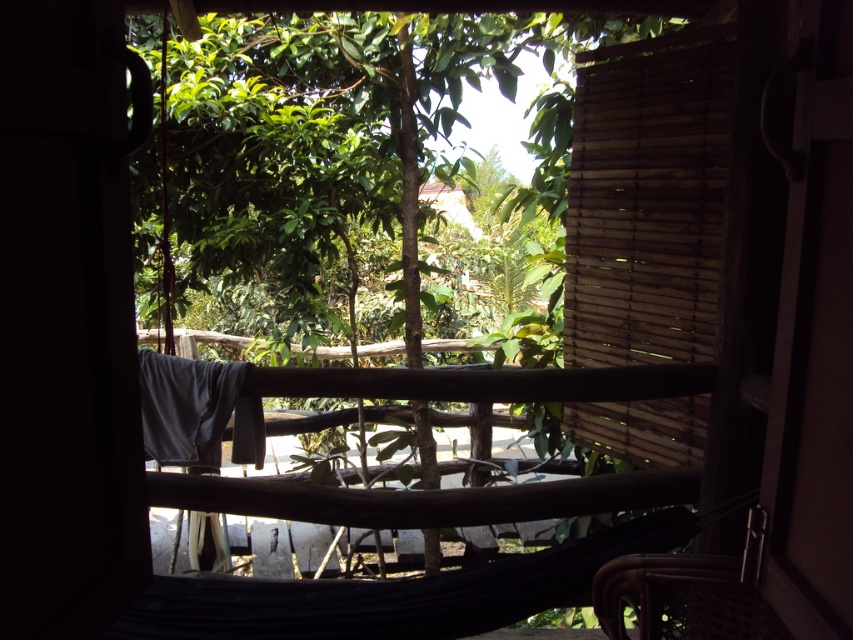
Question: Considering the real-world distances, which object is closest to the green leafy tree at center?

Choices:
 (A) brown woven chair at lower right
 (B) wooden blinds at right

Answer: (B)

Question: Can you confirm if green leafy tree at center is thinner than wooden blinds at right?

Choices:
 (A) no
 (B) yes

Answer: (A)

Question: Observing the image, what is the correct spatial positioning of wooden blinds at right in reference to brown woven chair at lower right?

Choices:
 (A) above
 (B) below

Answer: (A)

Question: Among these objects, which one is farthest from the camera?

Choices:
 (A) wooden blinds at right
 (B) green leafy tree at center
 (C) brown woven chair at lower right

Answer: (B)

Question: Does green leafy tree at center appear under wooden blinds at right?

Choices:
 (A) no
 (B) yes

Answer: (A)

Question: Which of the following is the closest to the observer?

Choices:
 (A) (666, 625)
 (B) (585, 113)

Answer: (A)